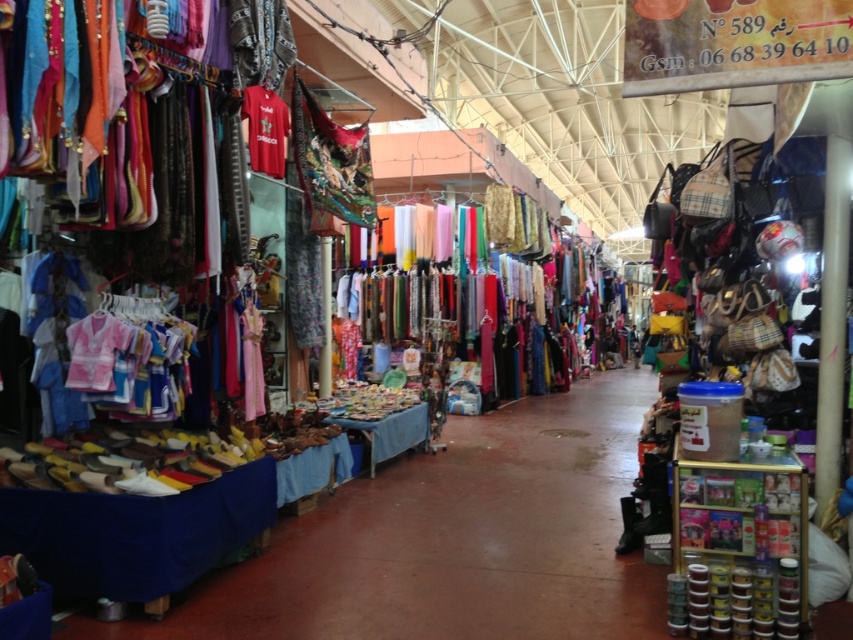
Question: Which of the following is the farthest from the observer?

Choices:
 (A) silky chiffon dresses at center
 (B) red matte t-shirt at upper center

Answer: (A)

Question: Which point is farther to the camera?

Choices:
 (A) silky chiffon dresses at center
 (B) red matte t-shirt at upper center

Answer: (A)

Question: Does silky chiffon dresses at center lie in front of red matte t-shirt at upper center?

Choices:
 (A) yes
 (B) no

Answer: (B)

Question: Can you confirm if silky chiffon dresses at center is positioned to the left of red matte t-shirt at upper center?

Choices:
 (A) no
 (B) yes

Answer: (A)

Question: In this image, where is silky chiffon dresses at center located relative to red matte t-shirt at upper center?

Choices:
 (A) below
 (B) above

Answer: (A)

Question: Which object appears closest to the camera in this image?

Choices:
 (A) silky chiffon dresses at center
 (B) red matte t-shirt at upper center

Answer: (B)